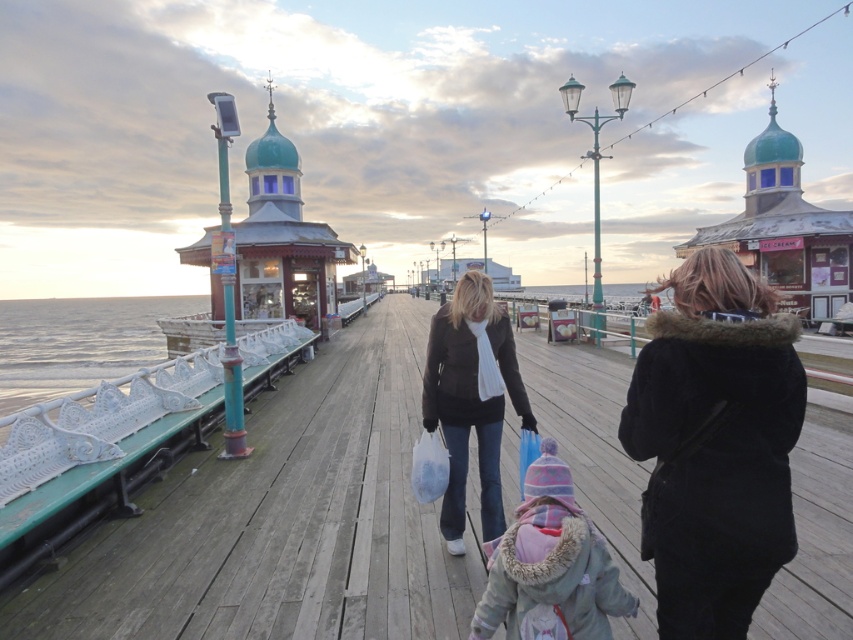
You are a photographer carrying a large camera bag that is 30 cm wide. You want to place it on the wooden dock at center without overlapping the dark brown leather jacket at center. Is there enough space?

The wooden dock at center might be wider than the dark brown leather jacket at center, so there could be enough space to place the camera bag without overlapping. However, since the exact width difference isn not specified, it depends on how much wider the dock is compared to the jacket.